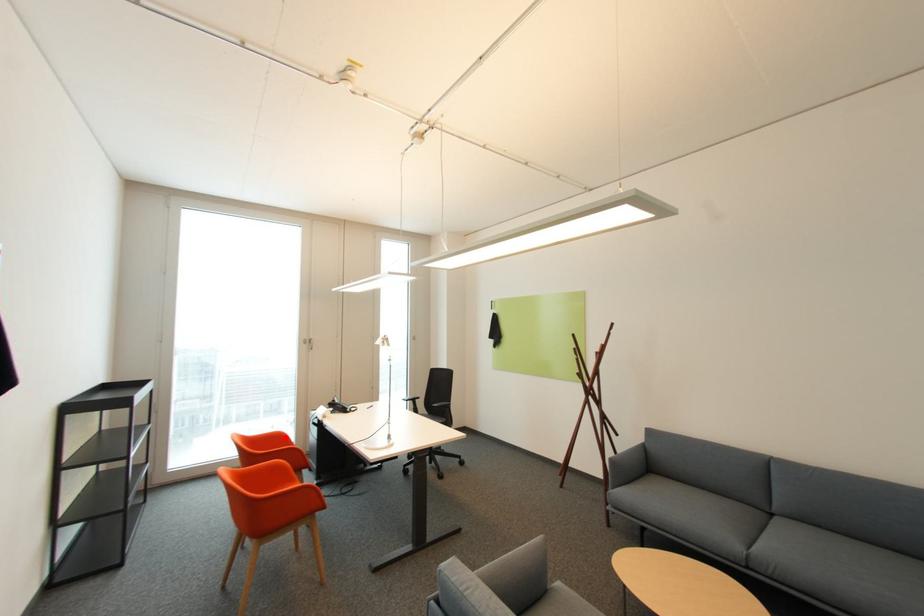
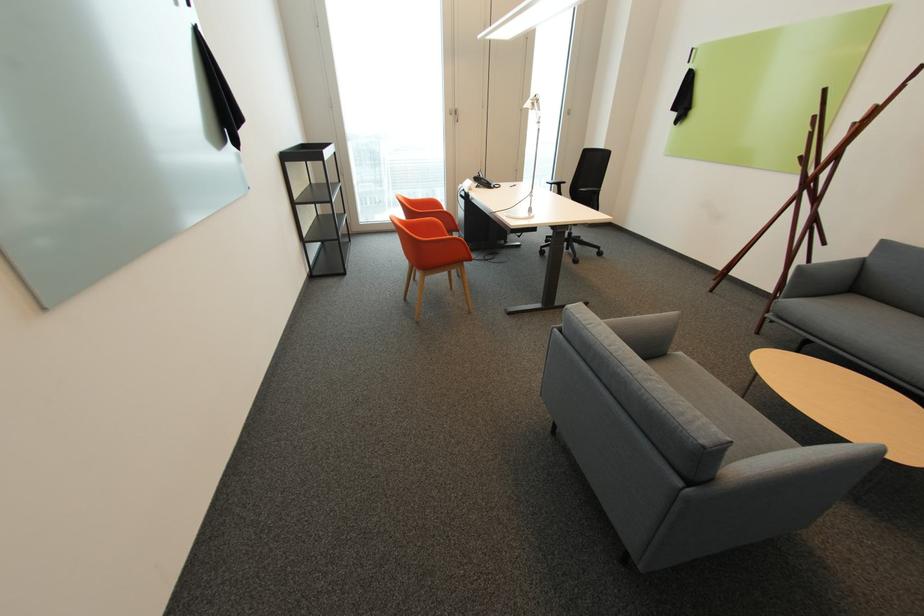
In the second image, find the point that corresponds to the highlighted location in the first image.

(440, 205)